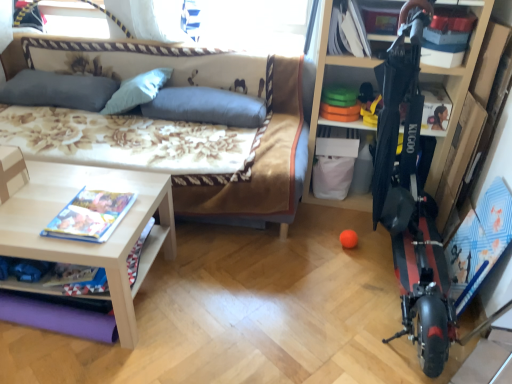
Question: Is gray fabric pillow at upper left, marked as the third pillow in a right-to-left arrangement, next to gray fabric pillow at upper center, the second pillow from the right, and touching it?

Choices:
 (A) no
 (B) yes

Answer: (A)

Question: Can you confirm if gray fabric pillow at upper left, marked as the first pillow in a left-to-right arrangement, is thinner than gray fabric pillow at upper center, the second pillow from the right?

Choices:
 (A) no
 (B) yes

Answer: (B)

Question: Can you confirm if gray fabric pillow at upper left, marked as the third pillow in a right-to-left arrangement, is positioned to the left of gray fabric pillow at upper center, which is the 2th pillow from left to right?

Choices:
 (A) yes
 (B) no

Answer: (A)

Question: From a real-world perspective, is gray fabric pillow at upper left, marked as the third pillow in a right-to-left arrangement, beneath gray fabric pillow at upper center, the second pillow from the right?

Choices:
 (A) no
 (B) yes

Answer: (B)

Question: Does gray fabric pillow at upper left, marked as the first pillow in a left-to-right arrangement, have a greater width compared to gray fabric pillow at upper center, which is the 2th pillow from left to right?

Choices:
 (A) no
 (B) yes

Answer: (A)

Question: From a real-world perspective, relative to light wood/texture table at lower left, is gray fabric pillow at upper left, marked as the third pillow in a right-to-left arrangement, vertically above or below?

Choices:
 (A) below
 (B) above

Answer: (B)

Question: Considering the relative positions of gray fabric pillow at upper left, marked as the third pillow in a right-to-left arrangement, and light wood/texture table at lower left in the image provided, is gray fabric pillow at upper left, marked as the third pillow in a right-to-left arrangement, to the left or to the right of light wood/texture table at lower left?

Choices:
 (A) left
 (B) right

Answer: (A)

Question: Looking at their shapes, would you say gray fabric pillow at upper left, marked as the first pillow in a left-to-right arrangement, is wider or thinner than light wood/texture table at lower left?

Choices:
 (A) wide
 (B) thin

Answer: (B)

Question: Considering their positions, is gray fabric pillow at upper left, marked as the third pillow in a right-to-left arrangement, located in front of or behind light wood/texture table at lower left?

Choices:
 (A) front
 (B) behind

Answer: (B)

Question: Based on their sizes in the image, would you say blue fabric pillow at center, which is counted as the third pillow, starting from the left, is bigger or smaller than gray fabric pillow at upper left, marked as the first pillow in a left-to-right arrangement?

Choices:
 (A) big
 (B) small

Answer: (A)

Question: From the image's perspective, is blue fabric pillow at center, the 1th pillow from the right, above or below gray fabric pillow at upper left, marked as the third pillow in a right-to-left arrangement?

Choices:
 (A) above
 (B) below

Answer: (B)

Question: Choose the correct answer: Is blue fabric pillow at center, the 1th pillow from the right, inside gray fabric pillow at upper left, marked as the first pillow in a left-to-right arrangement, or outside it?

Choices:
 (A) outside
 (B) inside

Answer: (A)

Question: Considering the relative positions of blue fabric pillow at center, which is counted as the third pillow, starting from the left, and gray fabric pillow at upper left, marked as the first pillow in a left-to-right arrangement, in the image provided, is blue fabric pillow at center, which is counted as the third pillow, starting from the left, to the left or to the right of gray fabric pillow at upper left, marked as the first pillow in a left-to-right arrangement,?

Choices:
 (A) right
 (B) left

Answer: (A)

Question: Based on their positions, is light wood/texture table at lower left located to the left or right of gray fabric pillow at upper left, marked as the third pillow in a right-to-left arrangement?

Choices:
 (A) left
 (B) right

Answer: (B)

Question: Is light wood/texture table at lower left bigger or smaller than gray fabric pillow at upper left, marked as the first pillow in a left-to-right arrangement?

Choices:
 (A) small
 (B) big

Answer: (B)